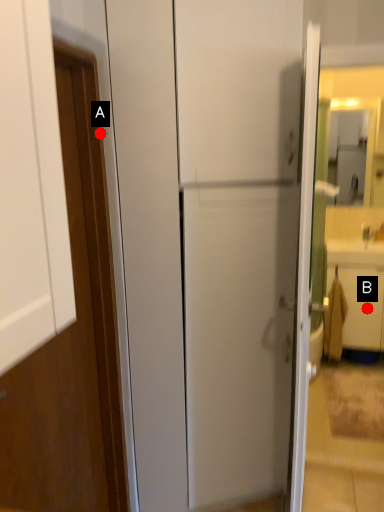
Question: Two points are circled on the image, labeled by A and B beside each circle. Which point appears farthest from the camera in this image?

Choices:
 (A) A is further
 (B) B is further

Answer: (B)